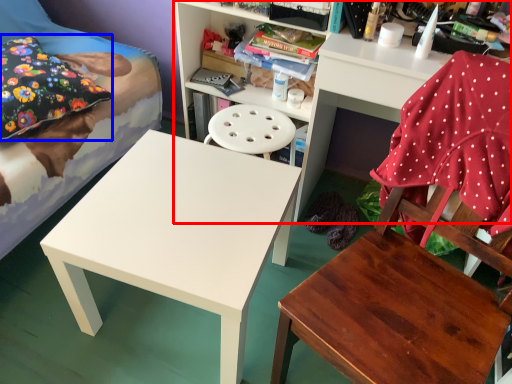
Question: Which of the following is the closest to the observer, shelf (highlighted by a red box) or pillow (highlighted by a blue box)?

Choices:
 (A) shelf
 (B) pillow

Answer: (A)